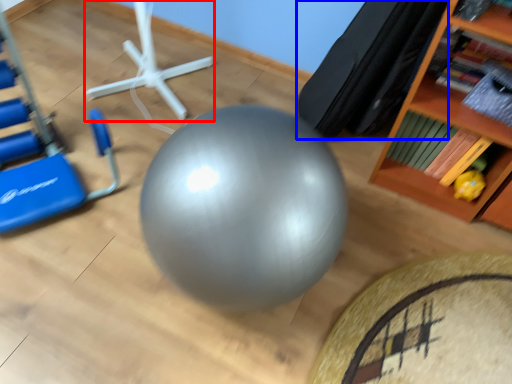
Question: Which object is closer to the camera taking this photo, sport equipment (highlighted by a red box) or bean bag chair (highlighted by a blue box)?

Choices:
 (A) sport equipment
 (B) bean bag chair

Answer: (B)